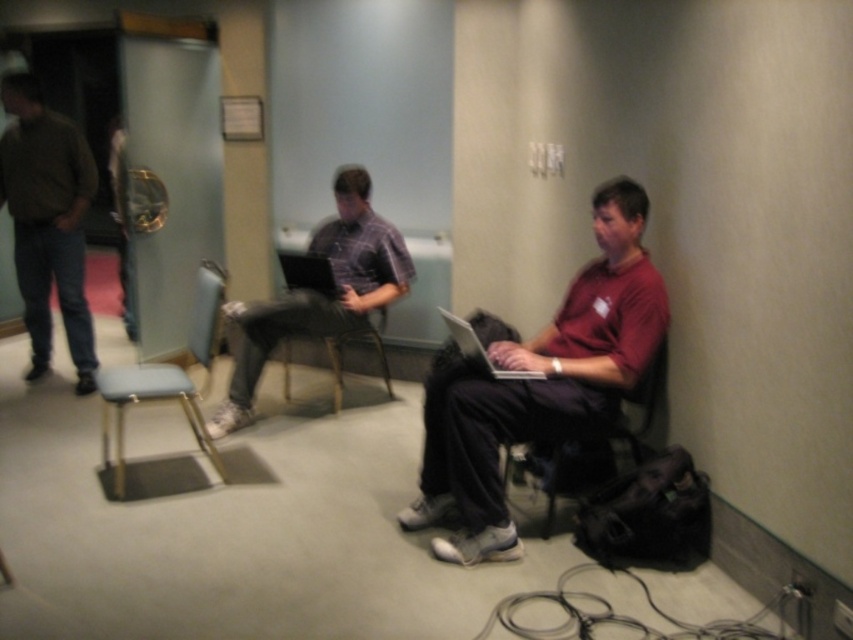
Is point (376, 301) positioned in front of point (285, 280)?

That is True.

Does plaid fabric shirt at center have a smaller size compared to matte black laptop at center?

Incorrect, plaid fabric shirt at center is not smaller in size than matte black laptop at center.

Which is behind, point (386, 278) or point (287, 257)?

Point (386, 278)

Identify the location of plaid fabric shirt at center. (318, 292).

Who is more distant from viewer, (199, 422) or (488, 362)?

Point (199, 422)

Does point (128, 384) come farther from viewer compared to point (492, 368)?

Yes, point (128, 384) is behind point (492, 368).

Between point (120, 444) and point (502, 371), which one is positioned behind?

The point (120, 444) is behind.

This screenshot has height=640, width=853. Find the location of `light blue fabric stool at lower left`. light blue fabric stool at lower left is located at coordinates (148, 401).

Does point (436, 508) come behind point (467, 344)?

That is True.

Is point (477, 484) positioned in front of point (492, 372)?

Yes, it is.

Who is more distant from viewer, (606, 241) or (490, 372)?

The point (606, 241) is behind.

The width and height of the screenshot is (853, 640). In order to click on matte red shirt at center in this screenshot , I will do `click(543, 384)`.